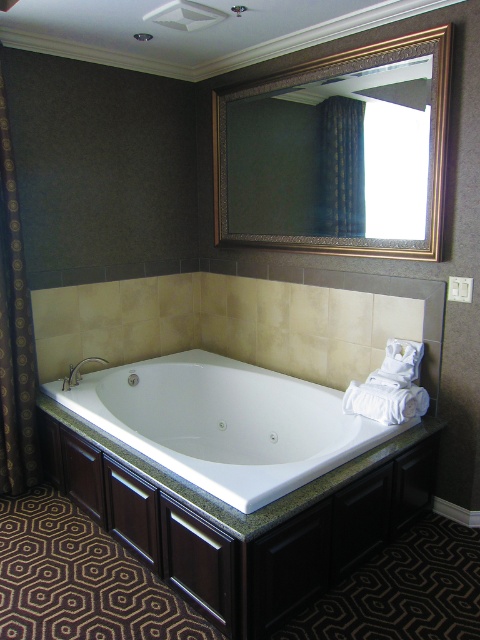
Is point (371, 435) positioned after point (326, 122)?

That is False.

Between point (238, 422) and point (339, 209), which one is positioned in front?

Positioned in front is point (339, 209).

Does point (274, 404) come closer to viewer compared to point (328, 104)?

No, (274, 404) is further to viewer.

The image size is (480, 640). I want to click on white glossy bathtub at center, so click(x=226, y=422).

Does gold textured mirror at upper center have a greater height compared to dark blue textured curtain at upper center?

Indeed, gold textured mirror at upper center has a greater height compared to dark blue textured curtain at upper center.

How far apart are gold textured mirror at upper center and dark blue textured curtain at upper center?

gold textured mirror at upper center is 6.99 inches from dark blue textured curtain at upper center.

Who is more distant from viewer, (x=360, y=128) or (x=348, y=228)?

The point (x=348, y=228) is more distant.

The height and width of the screenshot is (640, 480). What are the coordinates of `gold textured mirror at upper center` in the screenshot? It's located at click(338, 152).

Is point (326, 225) positioned in front of point (93, 358)?

That is True.

Who is more distant from viewer, (350,150) or (104,358)?

The point (104,358) is behind.

Locate an element on the screen. This screenshot has height=640, width=480. dark blue textured curtain at upper center is located at coordinates (340, 168).